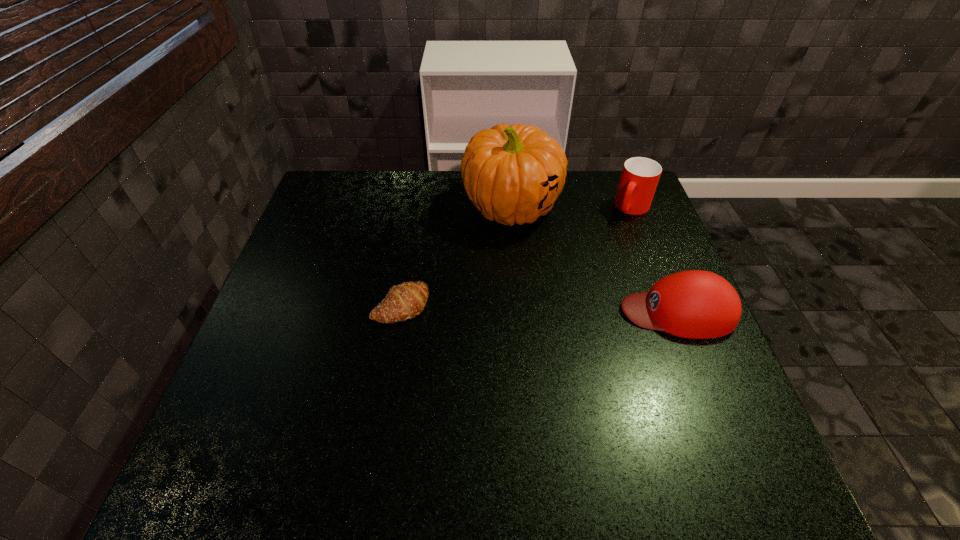
Where is `object at the far right corner`? object at the far right corner is located at coordinates click(640, 176).

Identify the location of free space at the far edge of the desktop. (575, 176).

The height and width of the screenshot is (540, 960). I want to click on free spot at the near edge of the desktop, so click(372, 429).

Locate an element on the screen. The height and width of the screenshot is (540, 960). free space at the left edge of the desktop is located at coordinates (256, 359).

You are a GUI agent. You are given a task and a screenshot of the screen. Output one action in this format:
    pyautogui.click(x=<x>, y=<y>)
    Task: Click on the free location at the right edge
    The height and width of the screenshot is (540, 960).
    Given the screenshot: What is the action you would take?
    pyautogui.click(x=667, y=381)

This screenshot has width=960, height=540. I want to click on free location at the far left corner, so click(329, 195).

You are a GUI agent. You are given a task and a screenshot of the screen. Output one action in this format:
    pyautogui.click(x=<x>, y=<y>)
    Task: Click on the vacant area between the leftmost object and the third tallest object
    This screenshot has width=960, height=540.
    Given the screenshot: What is the action you would take?
    pyautogui.click(x=540, y=308)

Where is `free space that is in between the pumpkin and the third tallest object`? free space that is in between the pumpkin and the third tallest object is located at coordinates (x=594, y=259).

Find the location of a particular element. empty space between the cup and the third tallest object is located at coordinates point(655,259).

This screenshot has height=540, width=960. I want to click on free space between the crescent roll and the second shortest object, so click(x=540, y=308).